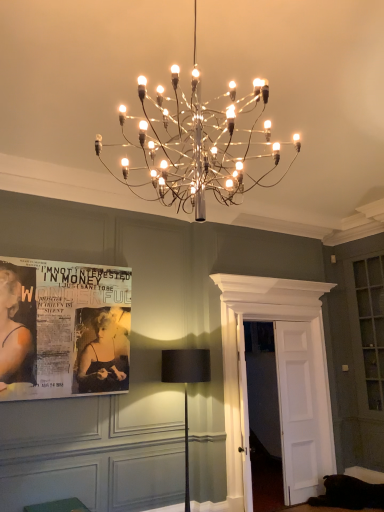
Question: Is green fabric cushion at lower left facing away from metallic wire chandelier at upper center, which is the 2th lamp in bottom-to-top order?

Choices:
 (A) no
 (B) yes

Answer: (A)

Question: Would you say green fabric cushion at lower left is outside metallic wire chandelier at upper center, the 1th lamp when ordered from top to bottom?

Choices:
 (A) no
 (B) yes

Answer: (B)

Question: Is green fabric cushion at lower left in contact with metallic wire chandelier at upper center, the 1th lamp when ordered from top to bottom?

Choices:
 (A) no
 (B) yes

Answer: (A)

Question: From the image's perspective, is green fabric cushion at lower left located beneath metallic wire chandelier at upper center, which is the first lamp from front to back?

Choices:
 (A) no
 (B) yes

Answer: (B)

Question: Is metallic wire chandelier at upper center, the 1th lamp when ordered from top to bottom, inside green fabric cushion at lower left?

Choices:
 (A) no
 (B) yes

Answer: (A)

Question: From a real-world perspective, is green fabric cushion at lower left above or below black paper poster at left?

Choices:
 (A) below
 (B) above

Answer: (A)

Question: Visually, is green fabric cushion at lower left positioned to the left or to the right of black paper poster at left?

Choices:
 (A) right
 (B) left

Answer: (A)

Question: Does point (54, 506) appear closer or farther from the camera than point (56, 356)?

Choices:
 (A) closer
 (B) farther

Answer: (A)

Question: In terms of width, does green fabric cushion at lower left look wider or thinner when compared to black paper poster at left?

Choices:
 (A) wide
 (B) thin

Answer: (A)

Question: Does point (254, 151) appear closer or farther from the camera than point (62, 505)?

Choices:
 (A) closer
 (B) farther

Answer: (A)

Question: Relative to green fabric cushion at lower left, is metallic wire chandelier at upper center, which is the first lamp from front to back, in front or behind?

Choices:
 (A) behind
 (B) front

Answer: (B)

Question: In terms of width, does metallic wire chandelier at upper center, the second lamp in the back-to-front sequence, look wider or thinner when compared to green fabric cushion at lower left?

Choices:
 (A) wide
 (B) thin

Answer: (A)

Question: Based on their sizes in the image, would you say metallic wire chandelier at upper center, the second lamp in the back-to-front sequence, is bigger or smaller than green fabric cushion at lower left?

Choices:
 (A) small
 (B) big

Answer: (B)

Question: Is black paper poster at left in front of or behind metallic wire chandelier at upper center, which is the first lamp from front to back, in the image?

Choices:
 (A) front
 (B) behind

Answer: (B)

Question: Looking at their shapes, would you say black paper poster at left is wider or thinner than metallic wire chandelier at upper center, the second lamp in the back-to-front sequence?

Choices:
 (A) thin
 (B) wide

Answer: (A)